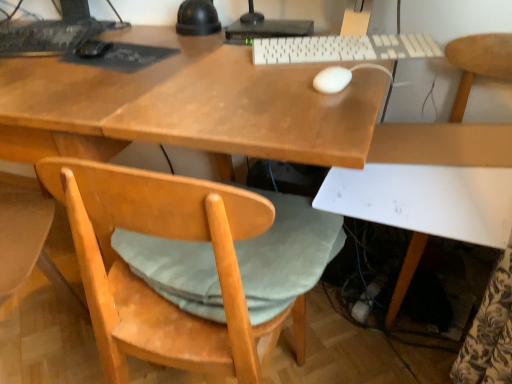
At what (x,y) coordinates should I click in order to perform the action: click on free location to the left of white plastic keyboard at center, the 1th computer keyboard when ordered from front to back. Please return your answer as a coordinate pair (x, y). Looking at the image, I should click on (217, 66).